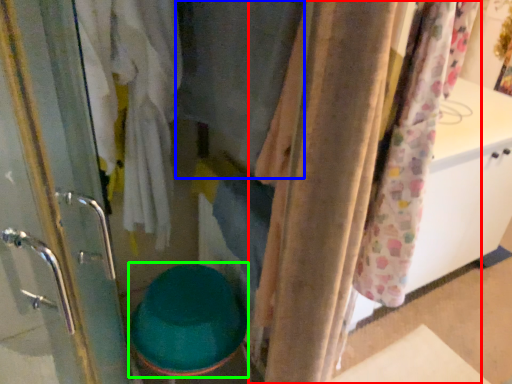
Question: Considering the real-world distances, which object is closest to curtain (highlighted by a red box)? clothing (highlighted by a blue box) or toilet bowl (highlighted by a green box).

Choices:
 (A) clothing
 (B) toilet bowl

Answer: (A)